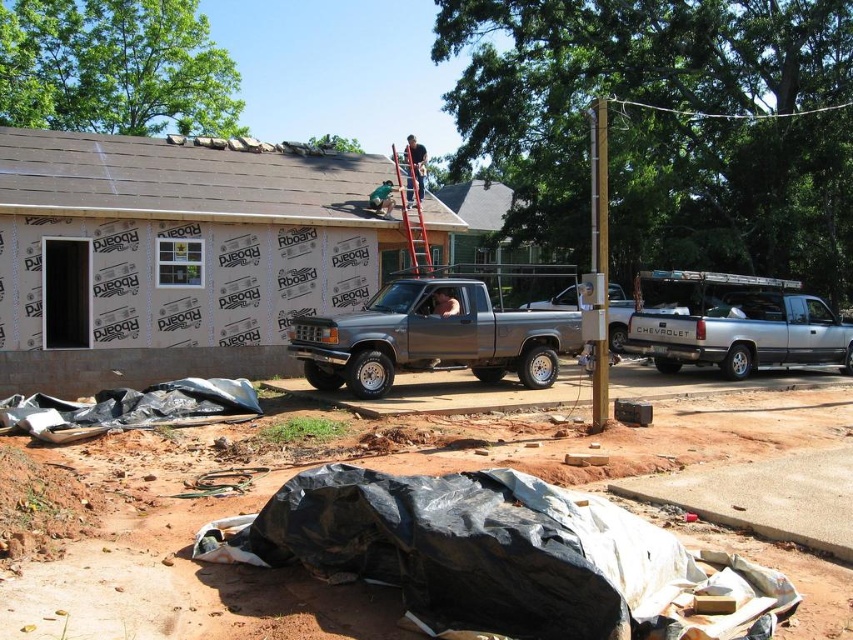
You are standing at the point with coordinates point (412, 205), which is the wooden ladder at center. You want to move to the nearest construction worker. Which direction should you go?

The wooden ladder at center is located at point (412, 205). Since the ladder is leaning against the house, and there are two workers on the roof, one standing and the other climbing up the ladder, the nearest worker would be the one climbing the ladder. Therefore, you should move upward along the ladder towards the worker climbing it.

In the scene shown: You are a safety inspector checking the construction site. You notice the wooden ladder at center and the matte black shirt at upper center. Which object is wider?

The wooden ladder at center is wider than the matte black shirt at upper center.

You are a delivery driver who needs to park your truck next to the silver metallic truck at right. However, there is a height restriction sign nearby stating that vehicles taller than 2 meters are prohibited. Given that the matte black shirt at upper center is 1.8 meters tall, can your truck safely park there without violating the height restriction?

The silver metallic truck at right is not as tall as the matte black shirt at upper center, which is 1.8 meters tall. Since the truck is shorter than the shirt, it is under the 2 meter height restriction. Therefore, your truck can safely park there without violating the height limit.